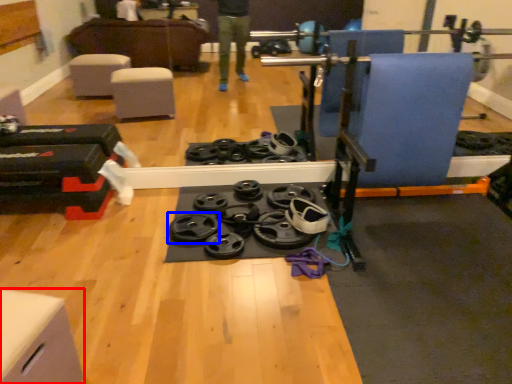
Question: Among these objects, which one is nearest to the camera, furniture (highlighted by a red box) or wheel (highlighted by a blue box)?

Choices:
 (A) furniture
 (B) wheel

Answer: (A)